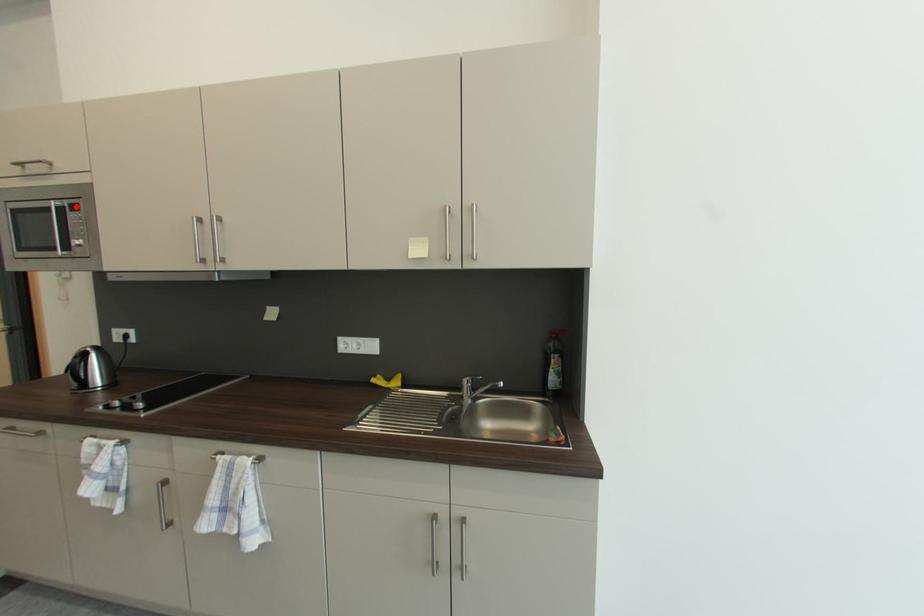
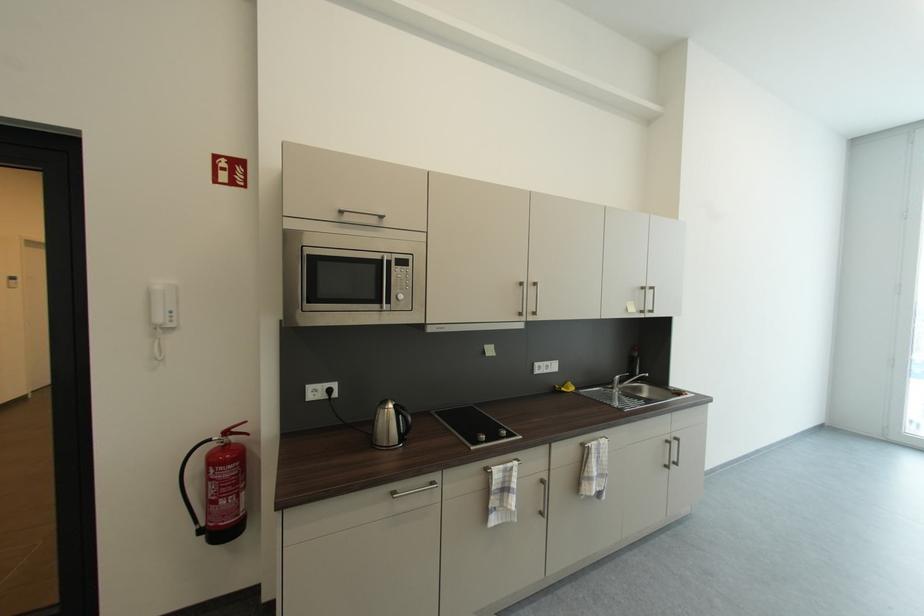
Where in the second image is the point corresponding to the highlighted location from the first image?

(403, 261)